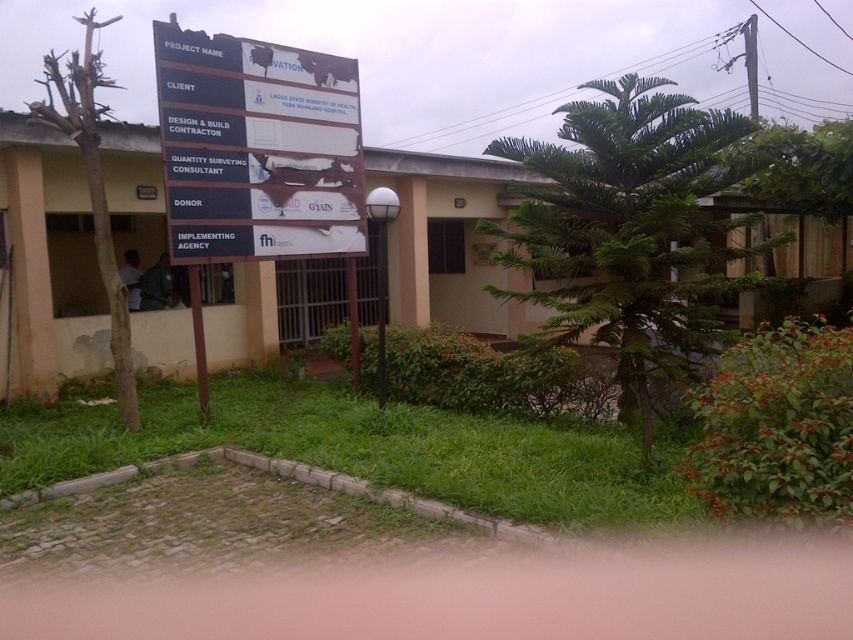
Does green leafy tree at center come behind white plastic sign at center?

→ That is False.

Does green leafy tree at center have a lesser height compared to white plastic sign at center?

In fact, green leafy tree at center may be taller than white plastic sign at center.

Does point (675, 310) lie behind point (218, 195)?

No.

This screenshot has height=640, width=853. I want to click on green leafy tree at center, so tap(630, 228).